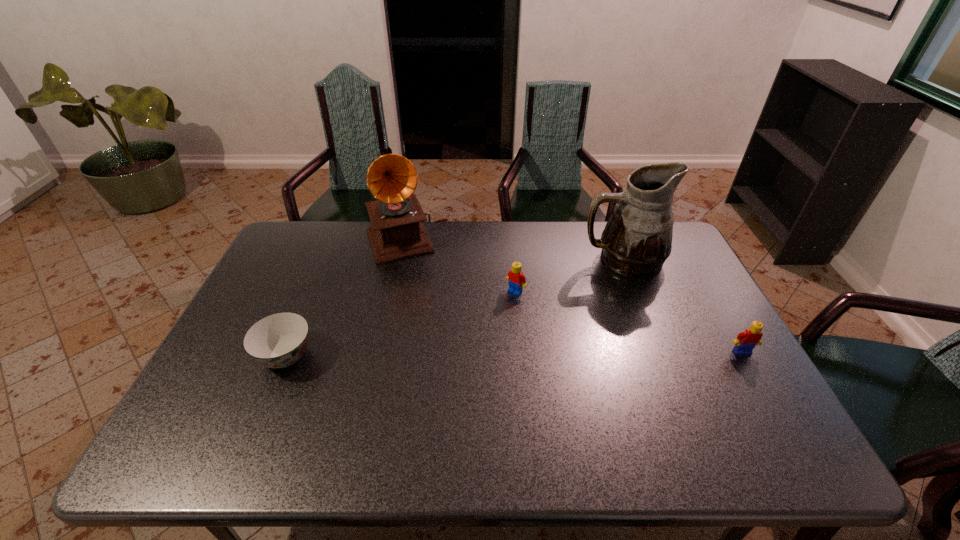
At what (x,y) coordinates should I click in order to perform the action: click on vacant space at the near left corner of the desktop. Please return your answer as a coordinate pair (x, y). Looking at the image, I should click on (254, 398).

Where is `vacant space in between the farther Lego and the nearer Lego`? Image resolution: width=960 pixels, height=540 pixels. vacant space in between the farther Lego and the nearer Lego is located at coordinates (629, 322).

This screenshot has height=540, width=960. I want to click on vacant area that lies between the phonograph record and the farther Lego, so click(461, 266).

At what (x,y) coordinates should I click in order to perform the action: click on vacant region between the shortest object and the left Lego. Please return your answer as a coordinate pair (x, y). Looking at the image, I should click on (400, 324).

Identify the location of free space between the fourth object from left to right and the soup bowl. The width and height of the screenshot is (960, 540). (454, 308).

Where is `free space between the nearer Lego and the fourth object from left to right`? free space between the nearer Lego and the fourth object from left to right is located at coordinates (682, 306).

This screenshot has width=960, height=540. I want to click on free space that is in between the farther Lego and the shortest object, so click(x=400, y=324).

I want to click on vacant space in between the farther Lego and the pitcher, so click(x=568, y=276).

I want to click on vacant space that's between the shortest object and the third nearest object, so click(x=400, y=324).

This screenshot has width=960, height=540. In order to click on blank region between the right Lego and the shortest object in this screenshot , I will do `click(514, 354)`.